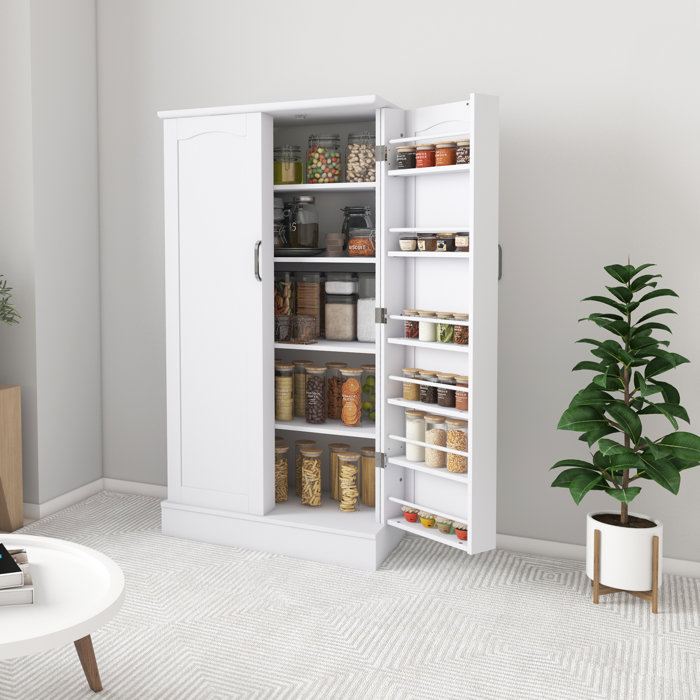
The height and width of the screenshot is (700, 700). What are the coordinates of `bars` in the screenshot? It's located at (432, 140), (438, 232), (428, 322), (424, 386), (441, 447), (405, 500).